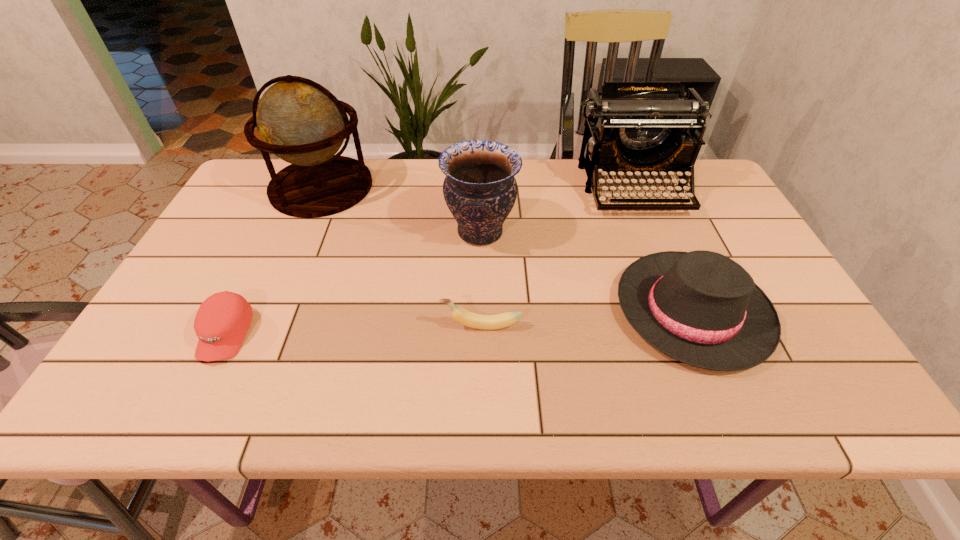
This screenshot has width=960, height=540. Identify the location of free space located 0.250m on the front handle of the pottery. (352, 232).

Find the location of a particular element. This screenshot has width=960, height=540. vacant space positioned 0.130m on the left of the third shortest object is located at coordinates (561, 311).

The height and width of the screenshot is (540, 960). In order to click on vacant area situated at the stem of the banana in this screenshot , I will do `click(388, 326)`.

The height and width of the screenshot is (540, 960). In order to click on vacant space located 0.390m at the stem of the banana in this screenshot , I will do click(267, 326).

Where is `free space located at the stem of the banana`? The width and height of the screenshot is (960, 540). free space located at the stem of the banana is located at coordinates (339, 326).

The image size is (960, 540). Find the location of `free location located 0.080m on the front-facing side of the shortest object`. free location located 0.080m on the front-facing side of the shortest object is located at coordinates (193, 401).

This screenshot has height=540, width=960. What are the coordinates of `globe that is positioned at the far edge` in the screenshot? It's located at (300, 121).

The image size is (960, 540). I want to click on typewriter situated at the far edge, so click(x=635, y=127).

Locate an element on the screen. The image size is (960, 540). object at the near edge is located at coordinates (701, 308).

Where is `globe present at the left edge`? globe present at the left edge is located at coordinates (300, 121).